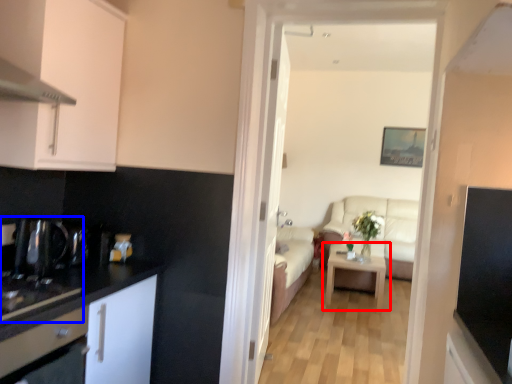
Question: Which object is further to the camera taking this photo, table (highlighted by a red box) or sink (highlighted by a blue box)?

Choices:
 (A) table
 (B) sink

Answer: (A)